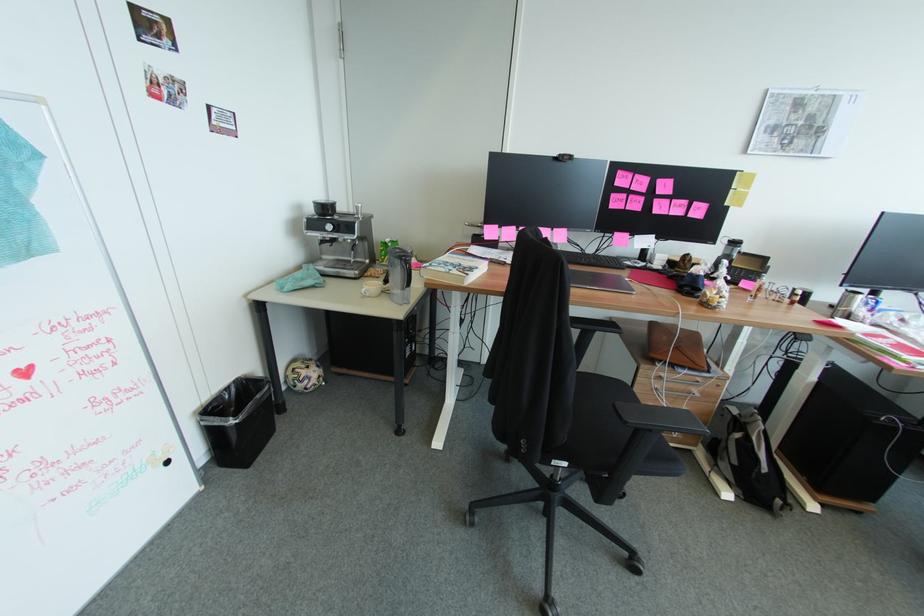
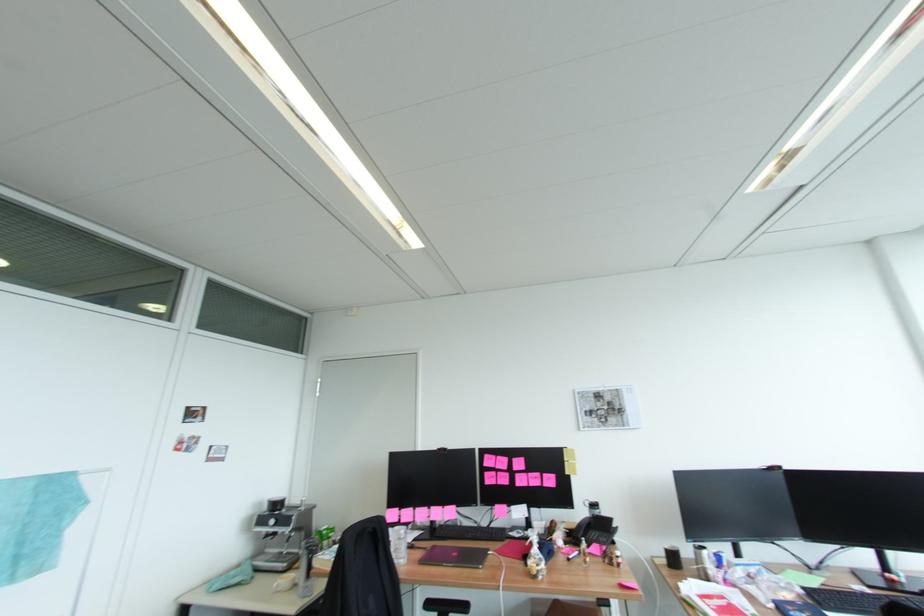
The point at (690, 201) is marked in the first image. Where is the corresponding point in the second image?

(542, 474)